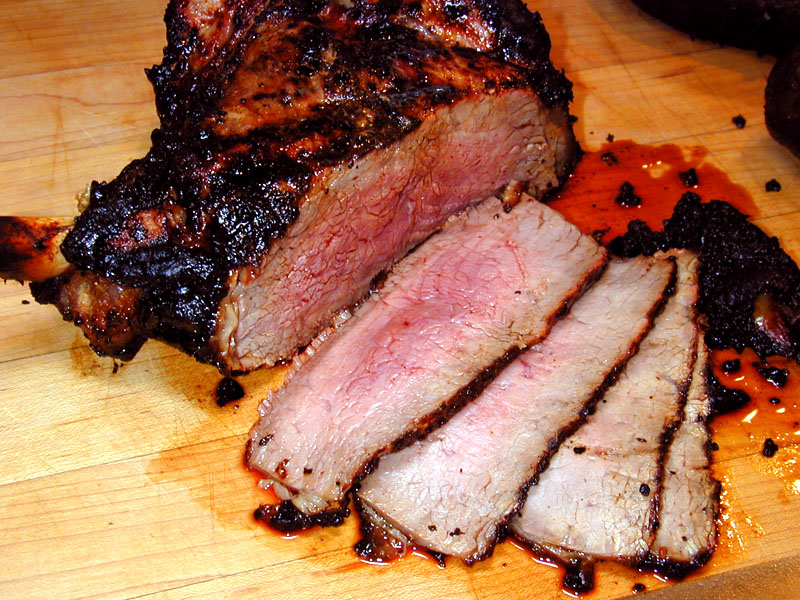
Find the location of a particular element. The height and width of the screenshot is (600, 800). cutting board is located at coordinates (77, 529).